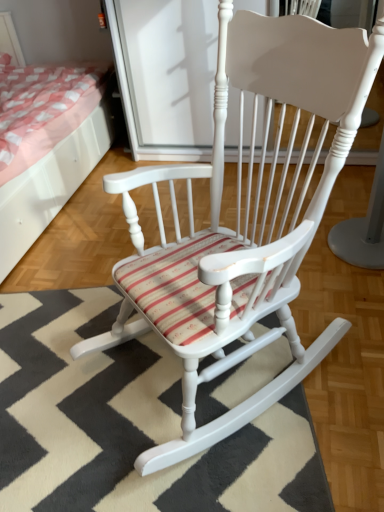
This screenshot has height=512, width=384. Describe the element at coordinates (130, 423) in the screenshot. I see `striped fabric doormat at center` at that location.

Locate an element on the screen. striped fabric doormat at center is located at coordinates (130, 423).

What do you see at coordinates (50, 184) in the screenshot? I see `matte pink fabric bed at upper left` at bounding box center [50, 184].

Identify the location of matte pink fabric bed at upper left. pos(50,184).

In order to face matte pink fabric bed at upper left, should I rotate leftwards or rightwards?

You should look left and rotate roughly 26.604 degrees.

Measure the distance between matte pink fabric bed at upper left and camera.

matte pink fabric bed at upper left is 1.95 meters away from camera.

Measure the distance between point (x=67, y=159) and camera.

A distance of 8.13 feet exists between point (x=67, y=159) and camera.

At what (x,y) coordinates should I click in order to perform the action: click on striped fabric doormat at center. Please return your answer as a coordinate pair (x, y). The height and width of the screenshot is (512, 384). Looking at the image, I should click on (130, 423).

Looking at this image, which object is positioned more to the right, matte pink fabric bed at upper left or striped fabric doormat at center?

striped fabric doormat at center is more to the right.

Considering the relative positions of matte pink fabric bed at upper left and striped fabric doormat at center in the image provided, is matte pink fabric bed at upper left in front of striped fabric doormat at center?

No.

Which is farther from the camera, (x=53, y=207) or (x=110, y=401)?

The point (x=53, y=207) is farther.

From the image's perspective, which one is positioned higher, matte pink fabric bed at upper left or striped fabric doormat at center?

matte pink fabric bed at upper left, from the image's perspective.

From a real-world perspective, between matte pink fabric bed at upper left and striped fabric doormat at center, who is vertically higher?

matte pink fabric bed at upper left is physically above.

Which object is thinner, matte pink fabric bed at upper left or striped fabric doormat at center?

Thinner between the two is striped fabric doormat at center.

In terms of height, does matte pink fabric bed at upper left look taller or shorter compared to striped fabric doormat at center?

Considering their sizes, matte pink fabric bed at upper left has more height than striped fabric doormat at center.

Which of these two, matte pink fabric bed at upper left or striped fabric doormat at center, is smaller?

Smaller between the two is striped fabric doormat at center.

Is striped fabric doormat at center located within matte pink fabric bed at upper left?

No.

Is matte pink fabric bed at upper left touching striped fabric doormat at center?

matte pink fabric bed at upper left is not next to striped fabric doormat at center, and they're not touching.

Is matte pink fabric bed at upper left turned away from striped fabric doormat at center?

No, matte pink fabric bed at upper left's orientation is not away from striped fabric doormat at center.

Find the location of `doormat that appears below the matte pink fabric bed at upper left (from the image's perspective)`. doormat that appears below the matte pink fabric bed at upper left (from the image's perspective) is located at coordinates (130, 423).

Does striped fabric doormat at center appear on the right side of matte pink fabric bed at upper left?

Indeed, striped fabric doormat at center is positioned on the right side of matte pink fabric bed at upper left.

Considering the positions of objects striped fabric doormat at center and matte pink fabric bed at upper left in the image provided, who is in front, striped fabric doormat at center or matte pink fabric bed at upper left?

Positioned in front is striped fabric doormat at center.

Which is further, (79, 392) or (90, 117)?

Point (90, 117)

From the image's perspective, which object appears higher, striped fabric doormat at center or matte pink fabric bed at upper left?

matte pink fabric bed at upper left appears higher in the image.

From a real-world perspective, who is located lower, striped fabric doormat at center or matte pink fabric bed at upper left?

From a 3D spatial view, striped fabric doormat at center is below.

Looking at this image, is striped fabric doormat at center wider or thinner than matte pink fabric bed at upper left?

Clearly, striped fabric doormat at center has less width compared to matte pink fabric bed at upper left.

Considering the sizes of striped fabric doormat at center and matte pink fabric bed at upper left in the image, is striped fabric doormat at center taller or shorter than matte pink fabric bed at upper left?

In the image, striped fabric doormat at center appears to be shorter than matte pink fabric bed at upper left.

Is striped fabric doormat at center bigger than matte pink fabric bed at upper left?

No, striped fabric doormat at center is not bigger than matte pink fabric bed at upper left.

Would you say striped fabric doormat at center contains matte pink fabric bed at upper left?

No, matte pink fabric bed at upper left is not surrounded by striped fabric doormat at center.

Based on the photo, are striped fabric doormat at center and matte pink fabric bed at upper left beside each other?

striped fabric doormat at center is not next to matte pink fabric bed at upper left, and they're not touching.

Is striped fabric doormat at center facing away from matte pink fabric bed at upper left?

No, matte pink fabric bed at upper left is not at the back of striped fabric doormat at center.

Can you tell me how much striped fabric doormat at center and matte pink fabric bed at upper left differ in facing direction?

They differ by 75.9 degrees in their facing directions.

In the scene shown: Measure the distance from striped fabric doormat at center to matte pink fabric bed at upper left.

The distance of striped fabric doormat at center from matte pink fabric bed at upper left is 93.13 centimeters.

Where is `bed above the striped fabric doormat at center (from the image's perspective)`? bed above the striped fabric doormat at center (from the image's perspective) is located at coordinates (50, 184).

Find the location of a particular element. The height and width of the screenshot is (512, 384). doormat located in front of the matte pink fabric bed at upper left is located at coordinates (130, 423).

Identify the location of bed above the striped fabric doormat at center (from the image's perspective). (50, 184).